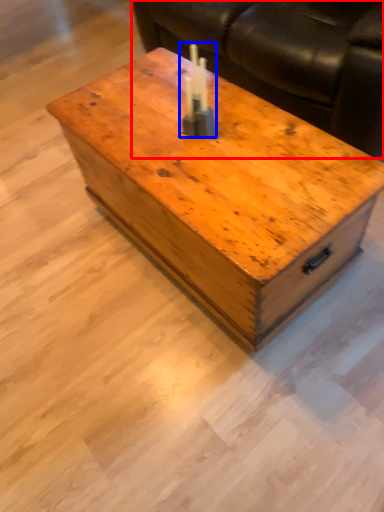
Question: Which of the following is the closest to the observer, couch (highlighted by a red box) or birthday candle (highlighted by a blue box)?

Choices:
 (A) couch
 (B) birthday candle

Answer: (B)